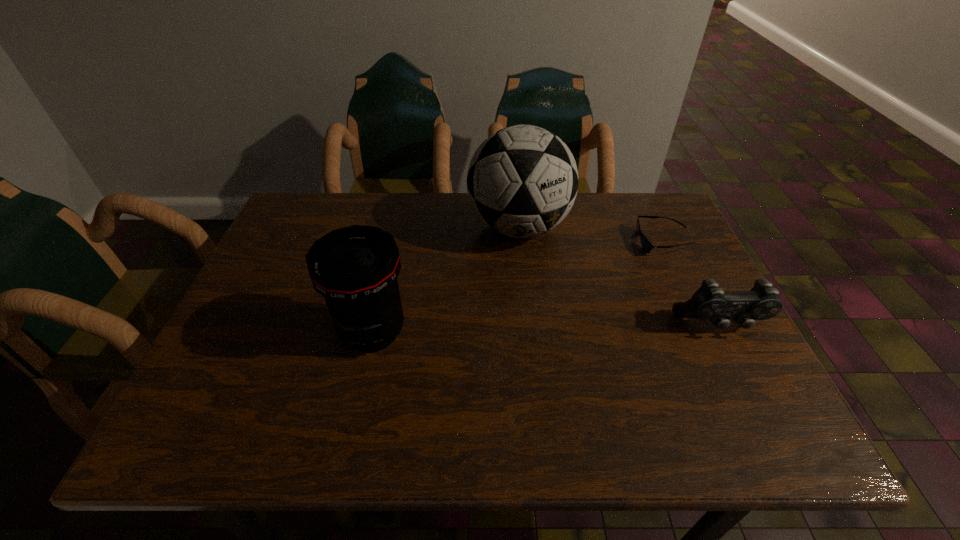
Find the location of a particular element. This screenshot has height=540, width=960. blank area located 0.190m on the surface of the third object from right to left where the brand logo is visible is located at coordinates (516, 315).

Find the location of `vacant point located at the front of the sunglasses showing the lenses`. vacant point located at the front of the sunglasses showing the lenses is located at coordinates (609, 274).

You are a GUI agent. You are given a task and a screenshot of the screen. Output one action in this format:
    pyautogui.click(x=<x>, y=<y>)
    Task: Click on the free space located at the front of the sunglasses showing the lenses
    Image resolution: width=960 pixels, height=540 pixels.
    Given the screenshot: What is the action you would take?
    pyautogui.click(x=587, y=287)

The height and width of the screenshot is (540, 960). Identify the location of vacant space located 0.110m at the front of the sunglasses showing the lenses. (618, 268).

I want to click on soccer ball positioned at the far edge, so click(x=522, y=181).

In order to click on sunglasses located at the far edge in this screenshot , I will do `click(646, 245)`.

Find the location of a particular element. control situated at the right edge is located at coordinates (709, 302).

Image resolution: width=960 pixels, height=540 pixels. In order to click on sunglasses that is at the right edge in this screenshot , I will do `click(646, 245)`.

You are a GUI agent. You are given a task and a screenshot of the screen. Output one action in this format:
    pyautogui.click(x=<x>, y=<y>)
    Task: Click on the object that is at the far right corner
    The width and height of the screenshot is (960, 540).
    Given the screenshot: What is the action you would take?
    pyautogui.click(x=646, y=245)

Locate an element on the screen. free space at the far edge of the desktop is located at coordinates (384, 200).